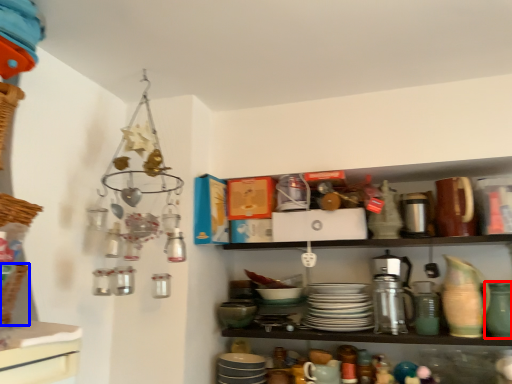
Question: Which point is further to the camera, tableware (highlighted by a red box) or basket (highlighted by a blue box)?

Choices:
 (A) tableware
 (B) basket

Answer: (A)